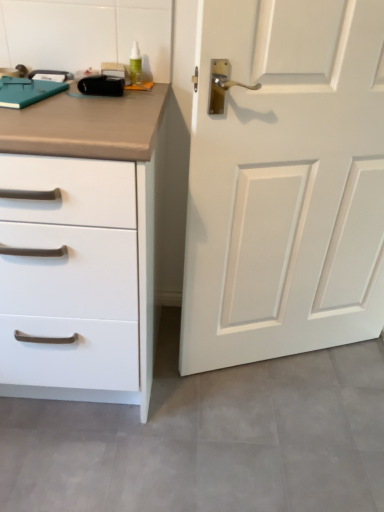
You are a GUI agent. You are given a task and a screenshot of the screen. Output one action in this format:
    pyautogui.click(x=<x>, y=<y>)
    Task: Click on the free spot in front of white matte door at right
    
    Given the screenshot: What is the action you would take?
    (x=285, y=426)